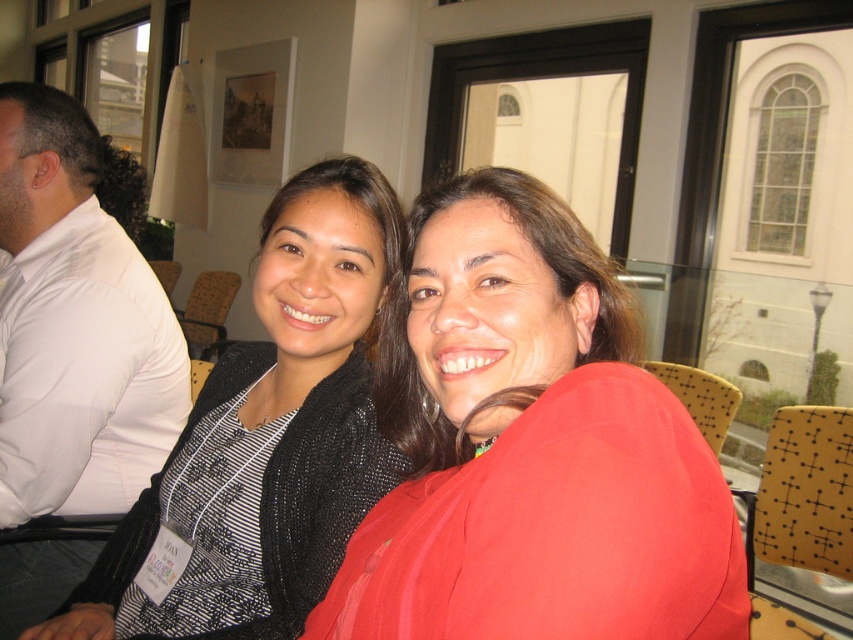
Where is the matte black jacket at center located in the image?

The matte black jacket at center is located at point [532,449] in the image.

You are standing in the conference room and want to walk towards the glass door leading outside. You notice two points marked on the floor at coordinates point [363,406] and point [100,493]. Which point should you step on first to reach the door more quickly?

Point [363,406] is in front of point [100,493], so stepping on point [363,406] first would lead you closer to the door more quickly.